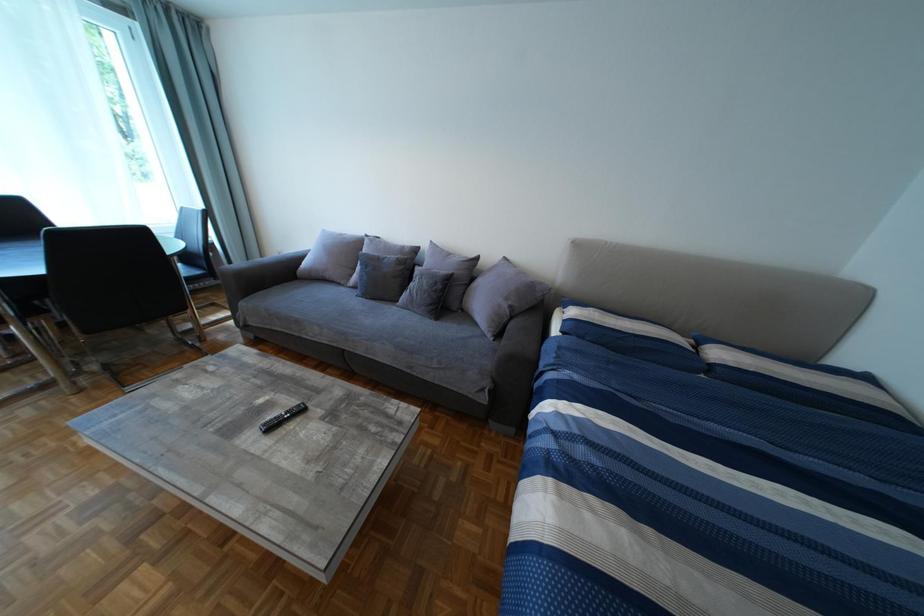
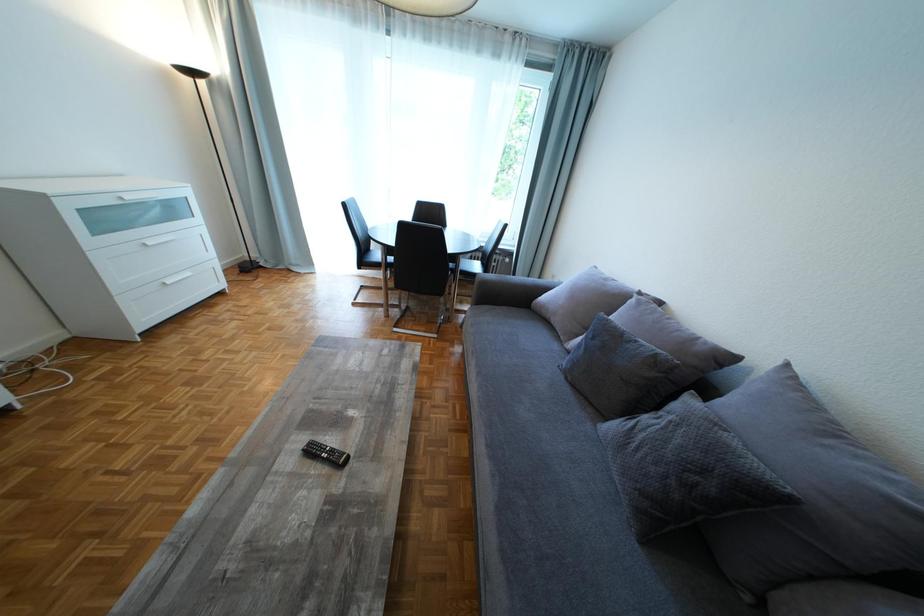
Question: Based on the continuous images, in which direction is the camera rotating? Reply with the corresponding letter.

Choices:
 (A) Left
 (B) Right
 (C) Up
 (D) Down

Answer: (A)